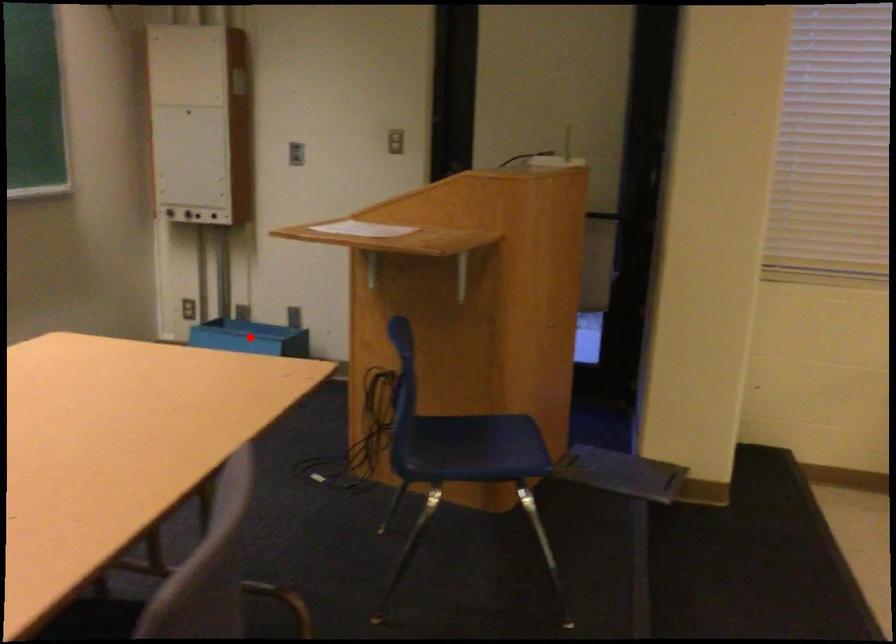
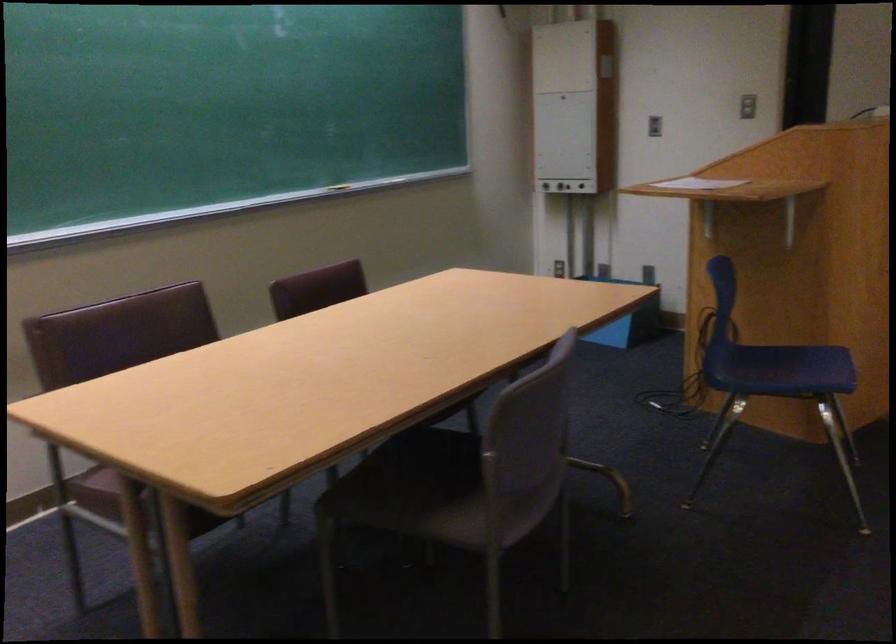
Question: I am providing you with two images of the same scene from different viewpoints. A red point is marked on the first image. Can you still see the location of the red point in image 2?

Choices:
 (A) Yes
 (B) No

Answer: (B)